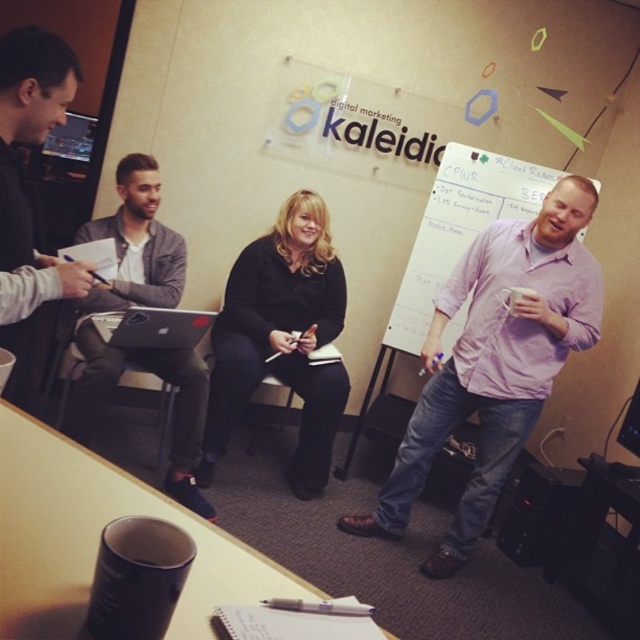
You are an interior designer assessing the office layout. The purple cotton shirt at right and the brushed metal laptop at left are both on the table. Which object takes up more horizontal space on the table?

The purple cotton shirt at right takes up more horizontal space on the table than the brushed metal laptop at left because its width surpasses the laptop.

You are an office worker standing at the entrance of the room. You notice the purple cotton shirt at right and the whiteboard at center. Which object is closer to the entrance? Please explain based on their positions.

The purple cotton shirt at right is closer to the entrance because it is positioned to the left of the whiteboard at center, which would place it nearer to the entrance if the entrance is on the right side of the room.